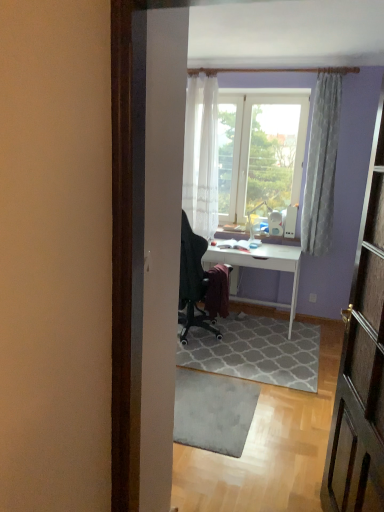
Question: Considering the relative sizes of white sheer curtain at upper center, which appears as the 1th curtain when viewed from the left, and gray textured rug at center, the 2th doormat positioned from the front, in the image provided, is white sheer curtain at upper center, which appears as the 1th curtain when viewed from the left, thinner than gray textured rug at center, the 2th doormat positioned from the front,?

Choices:
 (A) yes
 (B) no

Answer: (A)

Question: Does white sheer curtain at upper center, which appears as the 1th curtain when viewed from the left, lie behind gray textured rug at center, the 2th doormat positioned from the front?

Choices:
 (A) yes
 (B) no

Answer: (A)

Question: Are white sheer curtain at upper center, which appears as the 1th curtain when viewed from the left, and gray textured rug at center, the 2th doormat positioned from the front, far apart?

Choices:
 (A) yes
 (B) no

Answer: (A)

Question: Considering the relative sizes of white sheer curtain at upper center, positioned as the second curtain in right-to-left order, and gray textured rug at center, the 2th doormat positioned from the front, in the image provided, is white sheer curtain at upper center, positioned as the second curtain in right-to-left order, shorter than gray textured rug at center, the 2th doormat positioned from the front,?

Choices:
 (A) no
 (B) yes

Answer: (A)

Question: Is white sheer curtain at upper center, positioned as the second curtain in right-to-left order, looking in the opposite direction of gray textured rug at center, positioned as the 1th doormat in back-to-front order?

Choices:
 (A) no
 (B) yes

Answer: (A)

Question: Based on their positions, is gray textured rug at center, positioned as the 1th doormat in back-to-front order, located to the left or right of white sheer curtain at upper center, which appears as the 1th curtain when viewed from the left?

Choices:
 (A) right
 (B) left

Answer: (A)

Question: From their relative heights in the image, would you say gray textured rug at center, positioned as the 1th doormat in back-to-front order, is taller or shorter than white sheer curtain at upper center, which appears as the 1th curtain when viewed from the left?

Choices:
 (A) short
 (B) tall

Answer: (A)

Question: From the image's perspective, is gray textured rug at center, positioned as the 1th doormat in back-to-front order, positioned above or below white sheer curtain at upper center, which appears as the 1th curtain when viewed from the left?

Choices:
 (A) above
 (B) below

Answer: (B)

Question: From a real-world perspective, is gray textured rug at center, the 2th doormat positioned from the front, positioned above or below white sheer curtain at upper center, which appears as the 1th curtain when viewed from the left?

Choices:
 (A) below
 (B) above

Answer: (A)

Question: From a real-world perspective, relative to gray textured rug at center, positioned as the 1th doormat in back-to-front order, is white sheer curtain at upper center, which appears as the 1th curtain when viewed from the left, vertically above or below?

Choices:
 (A) below
 (B) above

Answer: (B)

Question: Looking at their shapes, would you say white sheer curtain at upper center, positioned as the second curtain in right-to-left order, is wider or thinner than gray textured rug at center, positioned as the 1th doormat in back-to-front order?

Choices:
 (A) thin
 (B) wide

Answer: (A)

Question: Is white sheer curtain at upper center, positioned as the second curtain in right-to-left order, taller or shorter than gray textured rug at center, positioned as the 1th doormat in back-to-front order?

Choices:
 (A) short
 (B) tall

Answer: (B)

Question: Considering the positions of point (193, 118) and point (236, 340), is point (193, 118) closer or farther from the camera than point (236, 340)?

Choices:
 (A) closer
 (B) farther

Answer: (B)

Question: Is white glossy desk at center wider or thinner than transparent glass window at center?

Choices:
 (A) wide
 (B) thin

Answer: (A)

Question: Is white glossy desk at center to the left or to the right of transparent glass window at center in the image?

Choices:
 (A) left
 (B) right

Answer: (A)